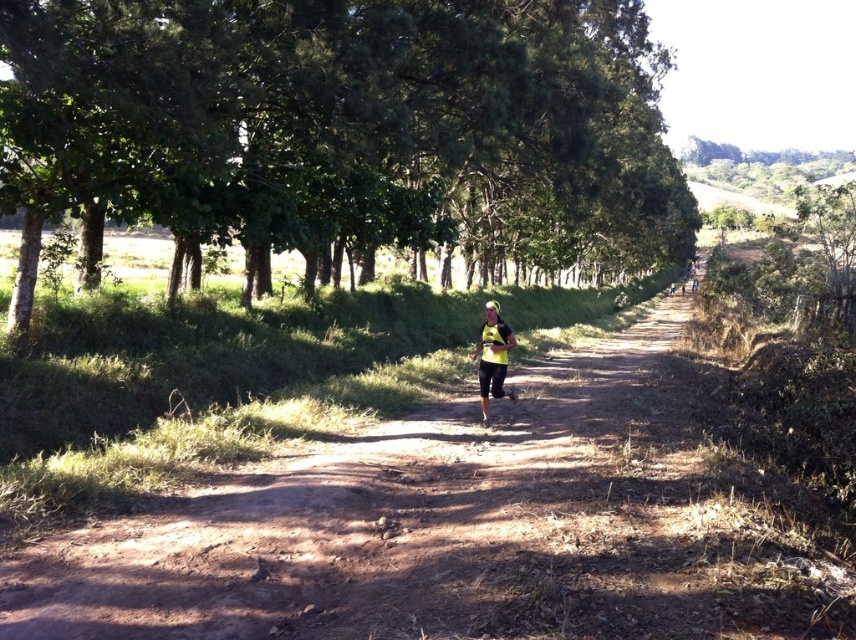
Which of these two, green leafy trees at center or yellow matte running outfit at center, stands shorter?

Standing shorter between the two is yellow matte running outfit at center.

Is green leafy trees at center positioned behind yellow matte running outfit at center?

No, green leafy trees at center is in front of yellow matte running outfit at center.

Identify the location of green leafy trees at center. The height and width of the screenshot is (640, 856). (358, 122).

Locate an element on the screen. The width and height of the screenshot is (856, 640). green leafy trees at center is located at coordinates (358, 122).